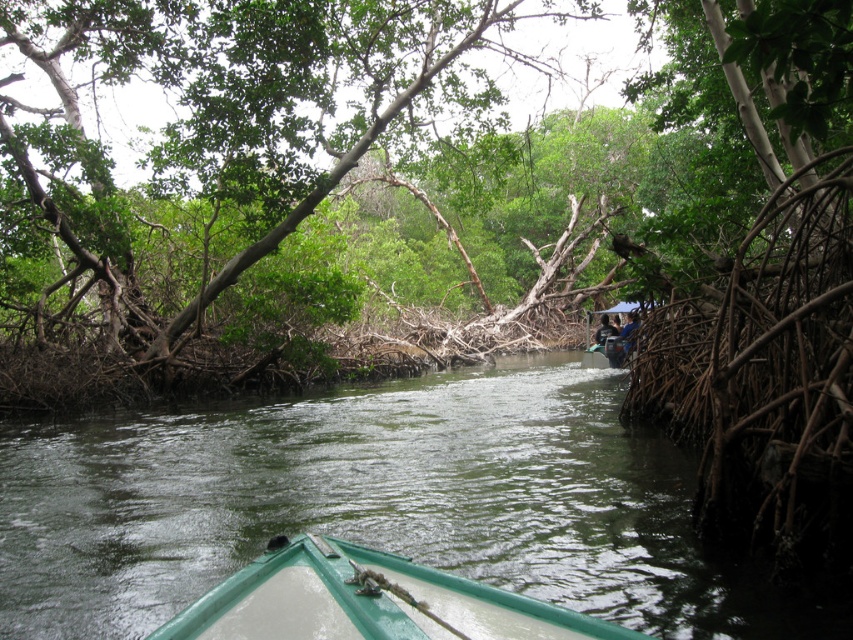
You are a kayaker planning to navigate through the narrow waterway between the mangrove roots. You see a green rubber boat at center and a dark blue fabric at center. Which object is wider and might require more space to pass through?

The green rubber boat at center is wider than the dark blue fabric at center, so it requires more space to pass through.

You are standing at the origin point of the image. Which direction should you move to reach the green leafy tree at center?

The green leafy tree at center is located at coordinates 0.287 on the x axis and 0.440 on the y axis. Since you are at the origin, you should move right along the x axis to 0.287 and up along the y axis to 0.440 to reach it.